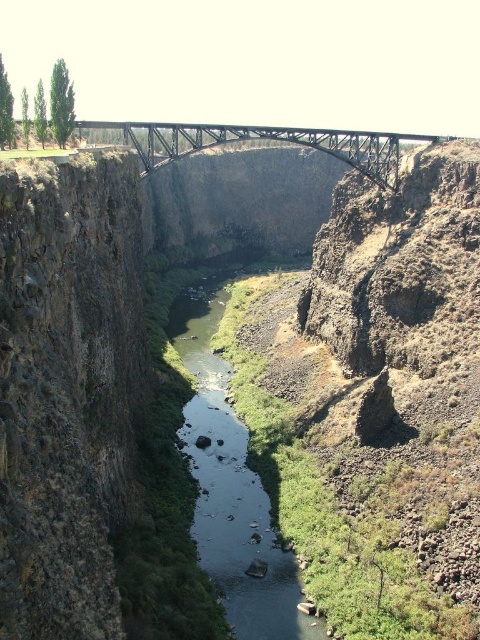
Question: Among these points, which one is nearest to the camera?

Choices:
 (A) (244, 579)
 (B) (249, 128)

Answer: (A)

Question: Is green smooth water at center below metallic steel bridge at center?

Choices:
 (A) yes
 (B) no

Answer: (A)

Question: Considering the relative positions of green smooth water at center and metallic steel bridge at center in the image provided, where is green smooth water at center located with respect to metallic steel bridge at center?

Choices:
 (A) below
 (B) above

Answer: (A)

Question: Does green smooth water at center have a smaller size compared to metallic steel bridge at center?

Choices:
 (A) yes
 (B) no

Answer: (A)

Question: Which object appears closest to the camera in this image?

Choices:
 (A) green smooth water at center
 (B) metallic steel bridge at center

Answer: (A)